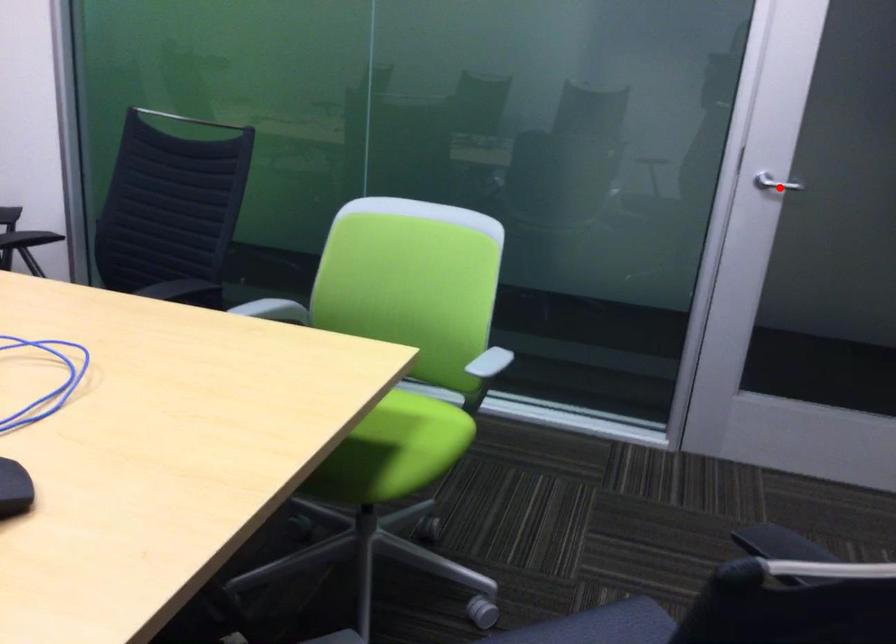
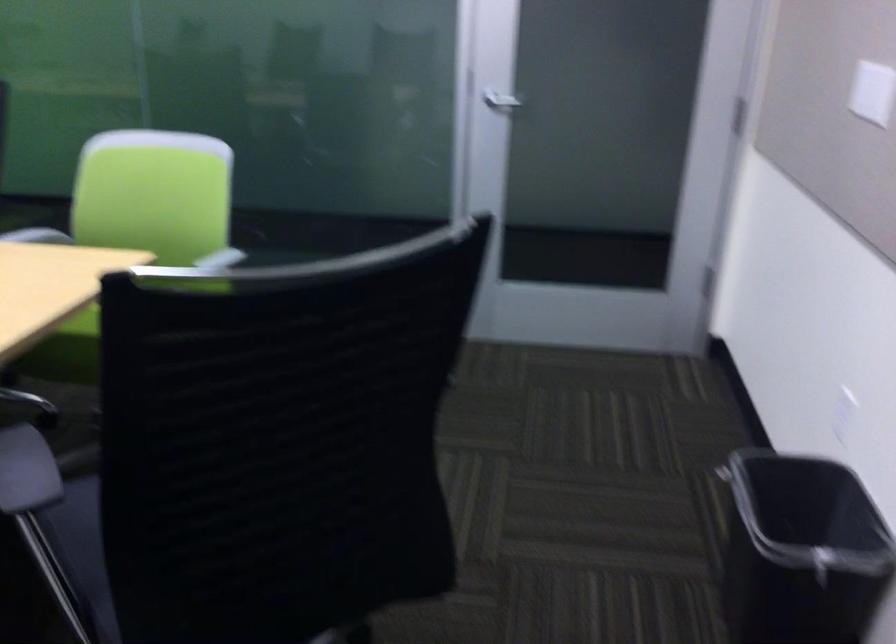
Question: I am providing you with two images of the same scene from different viewpoints. A red point is shown in image1. For the corresponding object point in image2, is it positioned nearer or farther from the camera?

Choices:
 (A) Nearer
 (B) Farther

Answer: (B)